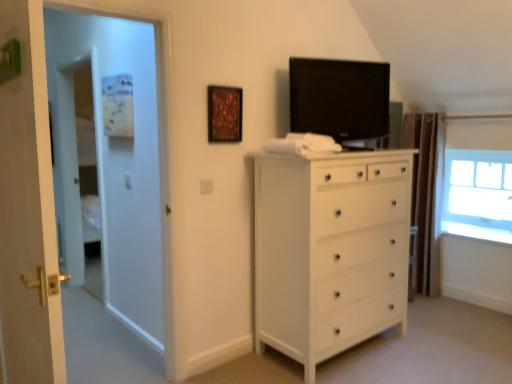
Locate an element on the screen. vacant area that lies to the right of white wood chest of drawers at center is located at coordinates (441, 340).